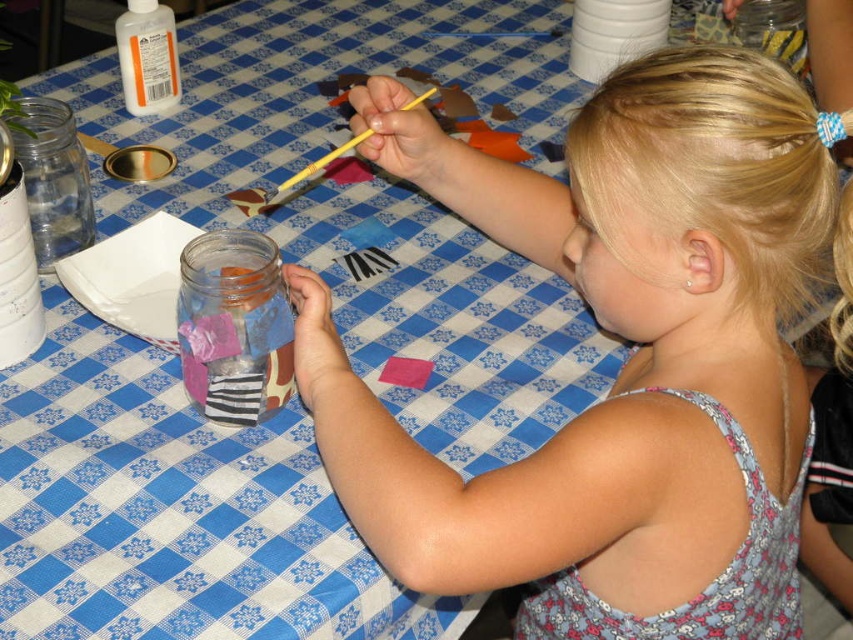
The child is painting a transparent glass jar at center. There is a point at coordinates (234, 326). Where exactly is this point located?

The point at coordinates (234, 326) is on the transparent glass jar at center.

You are standing at the table where the child is painting the glass jar. You need to place a sticker on the table at the point that is closer to you. Which point should you choose between point (x=512, y=500) and point (x=76, y=156)?

Point (x=76, y=156) is closer to you because it is behind point (x=512, y=500). Since the point in front is farther away, the one behind would be closer to your position at the table.

Looking at this image, you are a photographer standing at a certain distance from the scene. You want to take a closeup photo of the blonde hair at upper right. The camera requires the subject to be at least 50 centimeters away to focus properly. Is the current distance sufficient?

The blonde hair at upper right is 51.93 centimeters from the camera, which is more than the required 50 centimeters, so the distance is sufficient for the camera to focus properly.